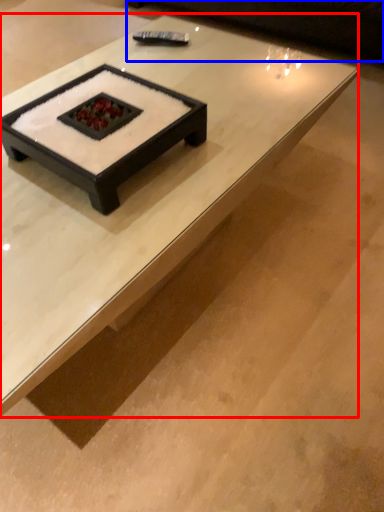
Question: Which object appears closest to the camera in this image, coffee table (highlighted by a red box) or couch (highlighted by a blue box)?

Choices:
 (A) coffee table
 (B) couch

Answer: (A)